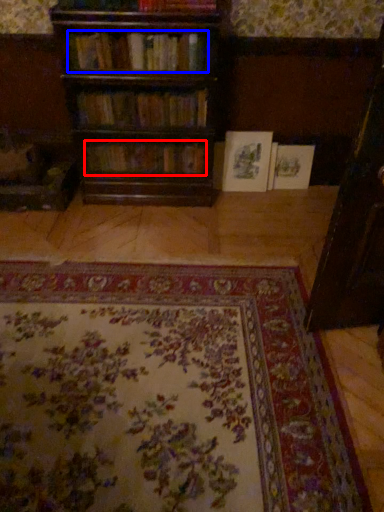
Question: Which object appears closest to the camera in this image, book (highlighted by a red box) or book (highlighted by a blue box)?

Choices:
 (A) book
 (B) book

Answer: (B)